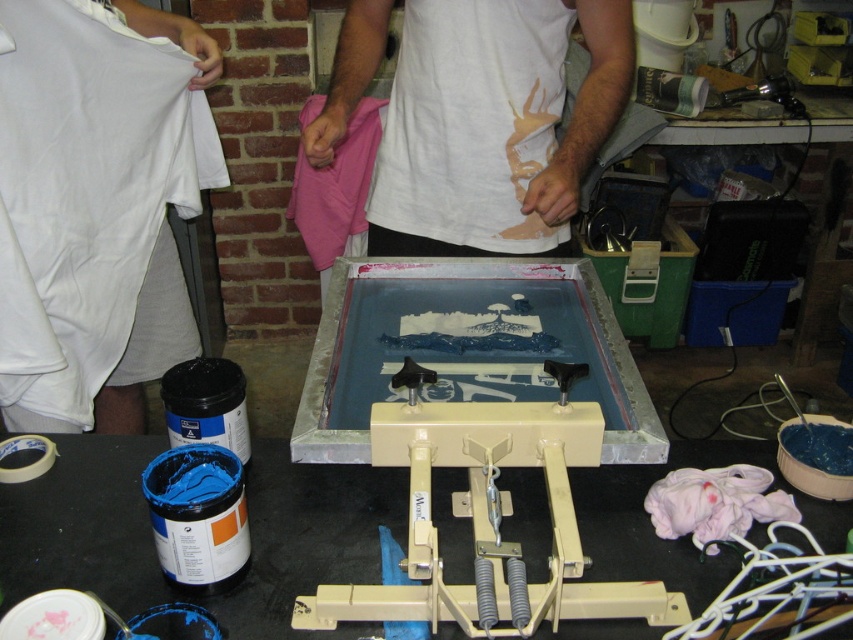
How distant is black plastic table at center from white cotton shirt at center?

black plastic table at center is 25.79 inches from white cotton shirt at center.

Is black plastic table at center thinner than white cotton shirt at center?

No.

At what (x,y) coordinates should I click in order to perform the action: click on black plastic table at center. Please return your answer as a coordinate pair (x, y). Looking at the image, I should click on (152, 540).

Can you confirm if white cotton t-shirt at left is positioned below black plastic table at center?

Incorrect, white cotton t-shirt at left is not positioned below black plastic table at center.

You are a GUI agent. You are given a task and a screenshot of the screen. Output one action in this format:
    pyautogui.click(x=<x>, y=<y>)
    Task: Click on the white cotton t-shirt at left
    
    Given the screenshot: What is the action you would take?
    pyautogui.click(x=96, y=205)

Find the location of a particular element. This screenshot has height=640, width=853. white cotton t-shirt at left is located at coordinates (96, 205).

Is white cotton t-shirt at left thinner than white cotton shirt at center?

Correct, white cotton t-shirt at left's width is less than white cotton shirt at center's.

Where is `white cotton t-shirt at left`? white cotton t-shirt at left is located at coordinates [96, 205].

Image resolution: width=853 pixels, height=640 pixels. What are the coordinates of `white cotton t-shirt at left` in the screenshot? It's located at (96, 205).